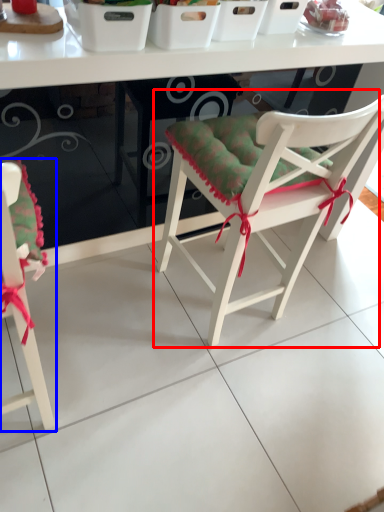
Question: Which of the following is the closest to the observer, chair (highlighted by a red box) or chair (highlighted by a blue box)?

Choices:
 (A) chair
 (B) chair

Answer: (B)